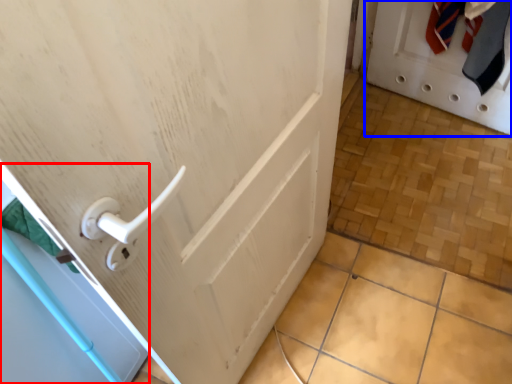
Question: Which object is closer to the camera taking this photo, screen door (highlighted by a red box) or door (highlighted by a blue box)?

Choices:
 (A) screen door
 (B) door

Answer: (A)